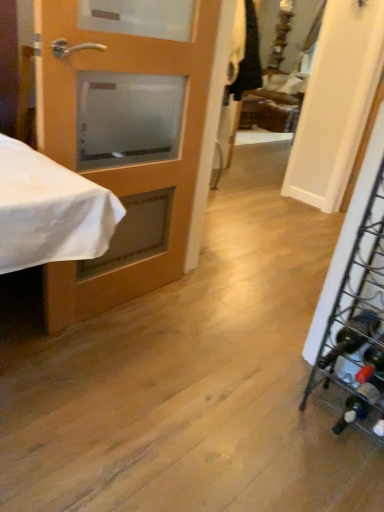
The height and width of the screenshot is (512, 384). Identify the location of vacant space to the right of matte wood door at left. (206, 329).